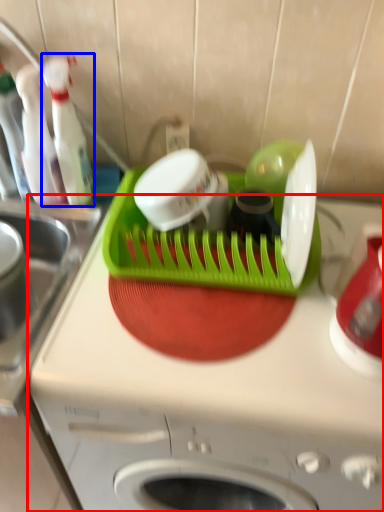
Question: Which object is closer to the camera taking this photo, home appliance (highlighted by a red box) or bottle (highlighted by a blue box)?

Choices:
 (A) home appliance
 (B) bottle

Answer: (A)